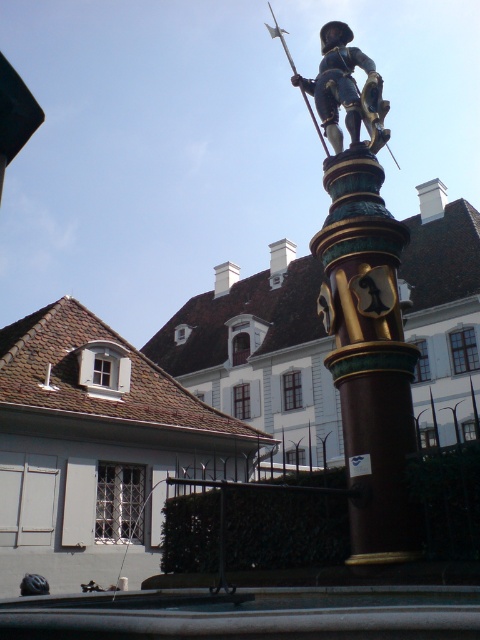
Question: Which object is closer to the camera taking this photo?

Choices:
 (A) gold polished pillar at center
 (B) polished bronze statue at center

Answer: (A)

Question: Where is gold polished pillar at center located in relation to polished bronze statue at center in the image?

Choices:
 (A) right
 (B) left

Answer: (B)

Question: Which of the following is the farthest from the observer?

Choices:
 (A) gold polished pillar at center
 (B) polished bronze statue at center

Answer: (B)

Question: Which point is closer to the camera taking this photo?

Choices:
 (A) (331, 205)
 (B) (336, 35)

Answer: (B)

Question: Is gold polished pillar at center to the left of polished bronze statue at center from the viewer's perspective?

Choices:
 (A) yes
 (B) no

Answer: (A)

Question: Does gold polished pillar at center lie in front of polished bronze statue at center?

Choices:
 (A) yes
 (B) no

Answer: (A)